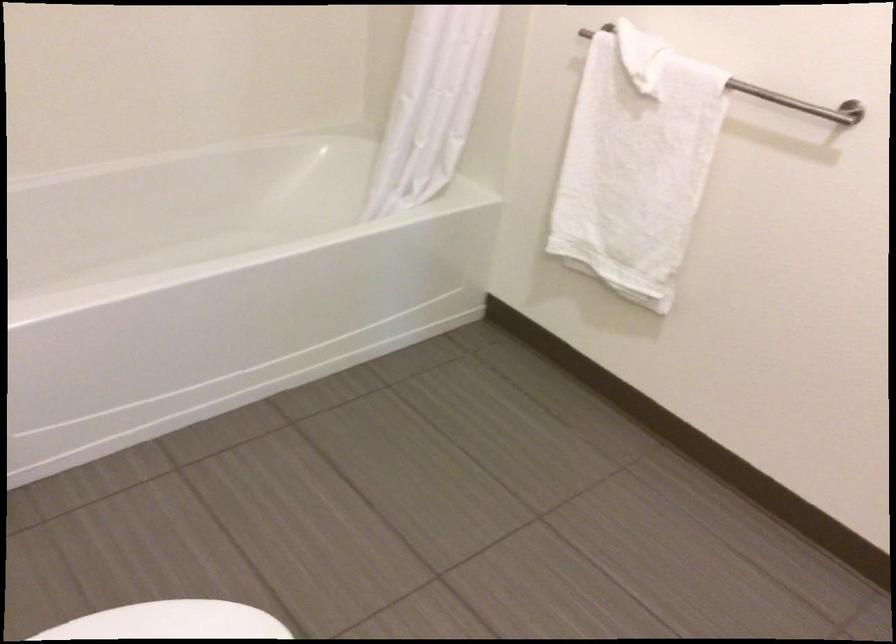
What do you see at coordinates (179, 619) in the screenshot? I see `a white toilet lid` at bounding box center [179, 619].